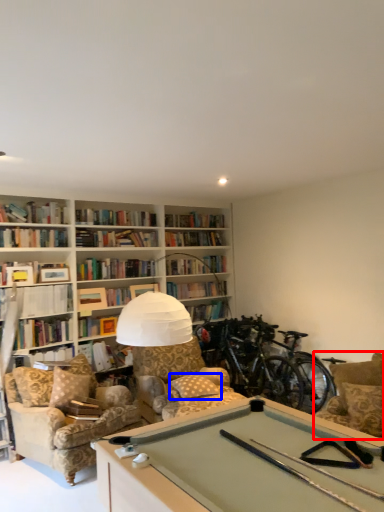
Question: Among these objects, which one is nearest to the camera, armchair (highlighted by a red box) or pillow (highlighted by a blue box)?

Choices:
 (A) armchair
 (B) pillow

Answer: (A)